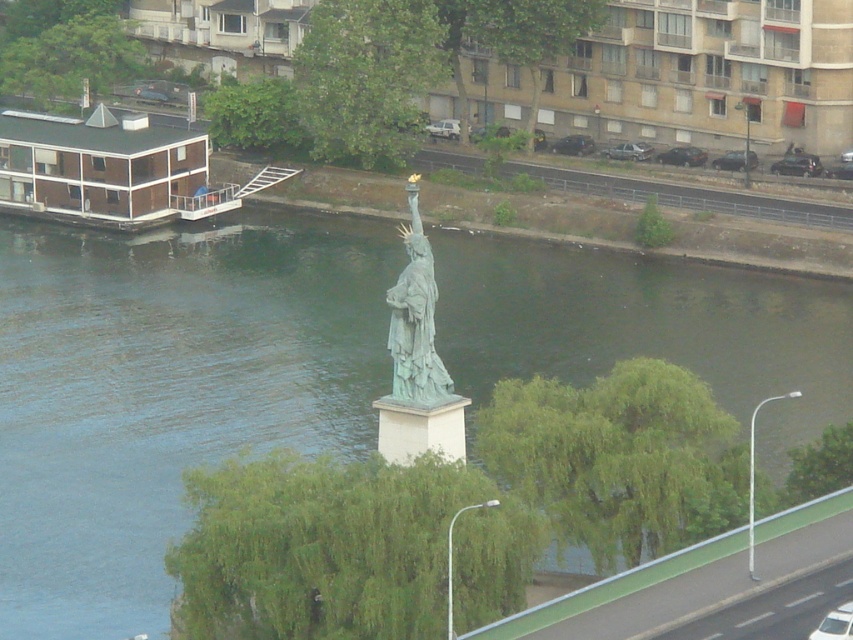
Question: Which of the following is the closest to the observer?

Choices:
 (A) greenish water at center
 (B) green patina statue at center

Answer: (B)

Question: Which point is farther to the camera?

Choices:
 (A) greenish water at center
 (B) green patina statue at center

Answer: (A)

Question: In this image, where is greenish water at center located relative to green patina statue at center?

Choices:
 (A) above
 (B) below

Answer: (B)

Question: Can you confirm if greenish water at center is thinner than green patina statue at center?

Choices:
 (A) no
 (B) yes

Answer: (A)

Question: Is the position of greenish water at center less distant than that of green patina statue at center?

Choices:
 (A) yes
 (B) no

Answer: (B)